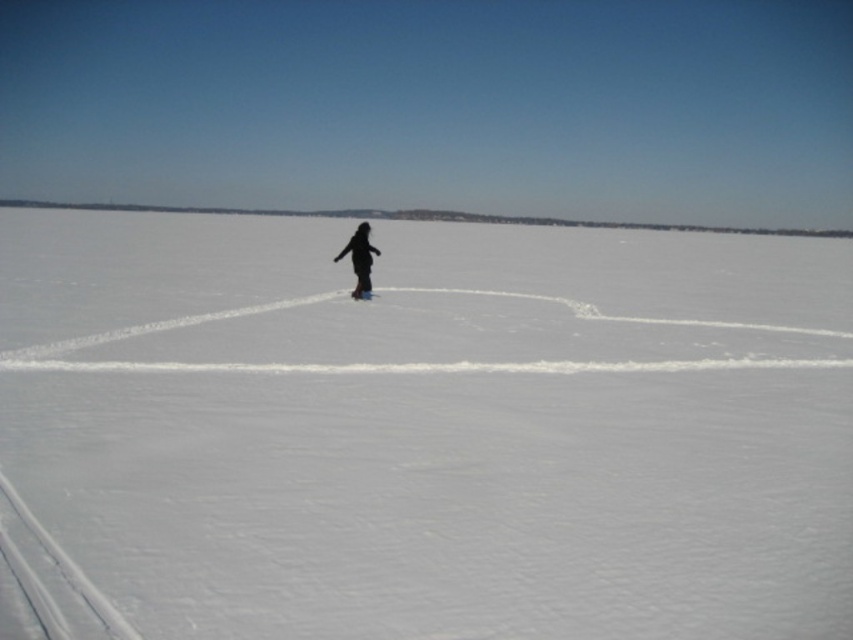
Can you confirm if white smooth snow at center is positioned to the left of white matte snowboard at center?

No, white smooth snow at center is not to the left of white matte snowboard at center.

Is white smooth snow at center wider than white matte snowboard at center?

Indeed, white smooth snow at center has a greater width compared to white matte snowboard at center.

The image size is (853, 640). Identify the location of white smooth snow at center. (421, 432).

Is black matte snowboarder at center taller than white matte snowboard at center?

Yes.

Does black matte snowboarder at center appear over white matte snowboard at center?

Yes.

What are the coordinates of `black matte snowboarder at center` in the screenshot? It's located at (358, 259).

Is white smooth snow at center bigger than black matte snowboarder at center?

Yes, white smooth snow at center is bigger than black matte snowboarder at center.

This screenshot has height=640, width=853. In order to click on white smooth snow at center in this screenshot , I will do `click(421, 432)`.

At what (x,y) coordinates should I click in order to perform the action: click on white smooth snow at center. Please return your answer as a coordinate pair (x, y). Looking at the image, I should click on (421, 432).

You are a GUI agent. You are given a task and a screenshot of the screen. Output one action in this format:
    pyautogui.click(x=<x>, y=<y>)
    Task: Click on the white smooth snow at center
    This screenshot has width=853, height=640.
    Given the screenshot: What is the action you would take?
    pyautogui.click(x=421, y=432)